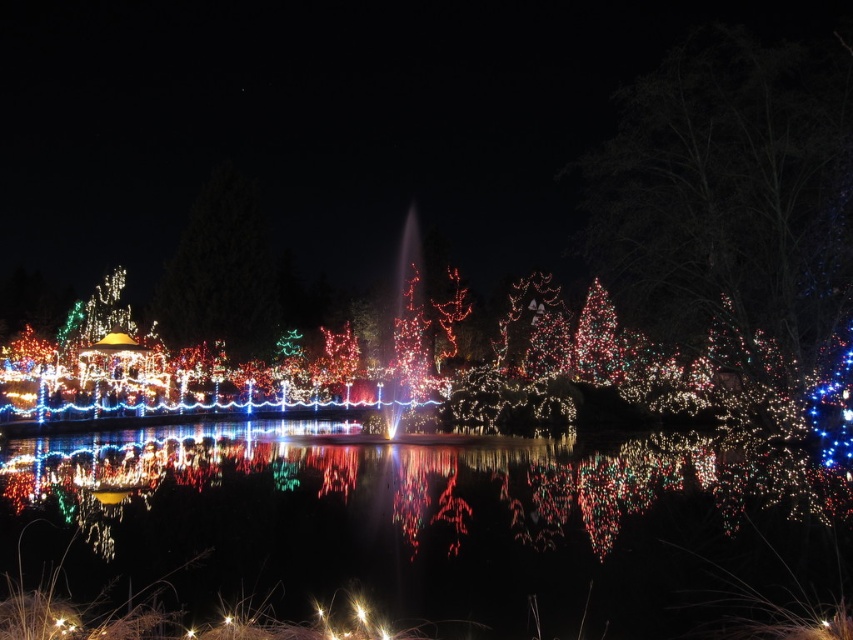
Which of these two, illuminated plastic tree at upper right or illuminated plastic tree at upper center, stands shorter?

illuminated plastic tree at upper center

The image size is (853, 640). Identify the location of illuminated plastic tree at upper right. (729, 192).

Does glistening reflective water at bottom have a greater height compared to illuminated plastic tree at upper center?

In fact, glistening reflective water at bottom may be shorter than illuminated plastic tree at upper center.

Is glistening reflective water at bottom shorter than illuminated plastic tree at upper center?

Yes.

Locate an element on the screen. The width and height of the screenshot is (853, 640). glistening reflective water at bottom is located at coordinates (445, 524).

Can you confirm if glistening reflective water at bottom is taller than illuminated plastic tree at upper right?

Incorrect, glistening reflective water at bottom's height is not larger of illuminated plastic tree at upper right's.

Who is shorter, glistening reflective water at bottom or illuminated plastic tree at upper right?

With less height is glistening reflective water at bottom.

Is point (495, 531) behind point (842, 148)?

That is False.

Where is `glistening reflective water at bottom`? glistening reflective water at bottom is located at coordinates (445, 524).